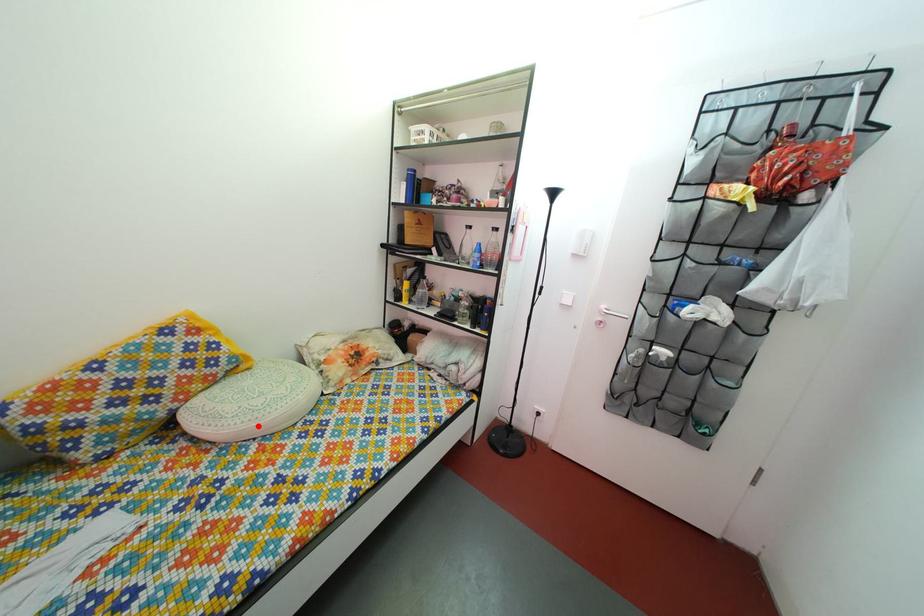
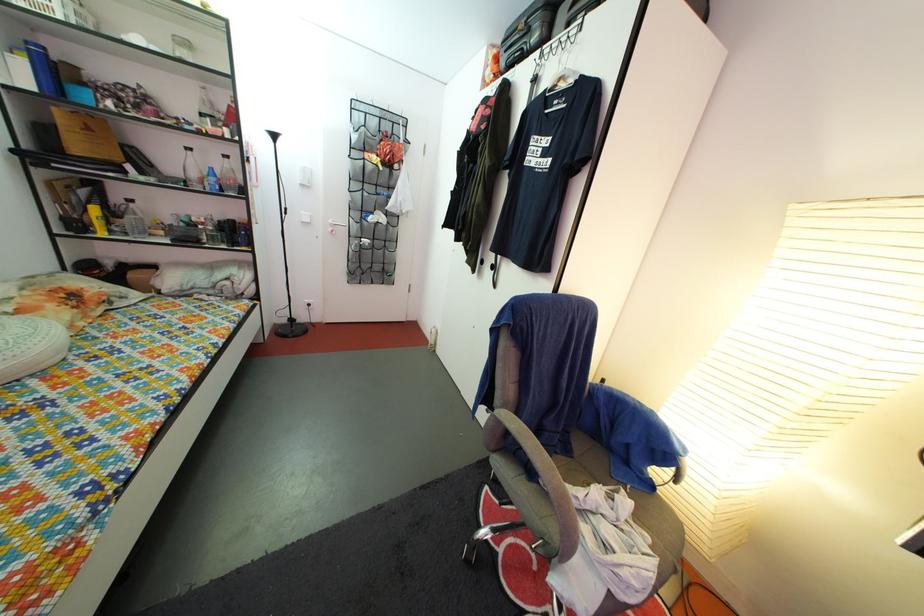
Find the pixel in the second image that matches the highlighted location in the first image.

(9, 366)